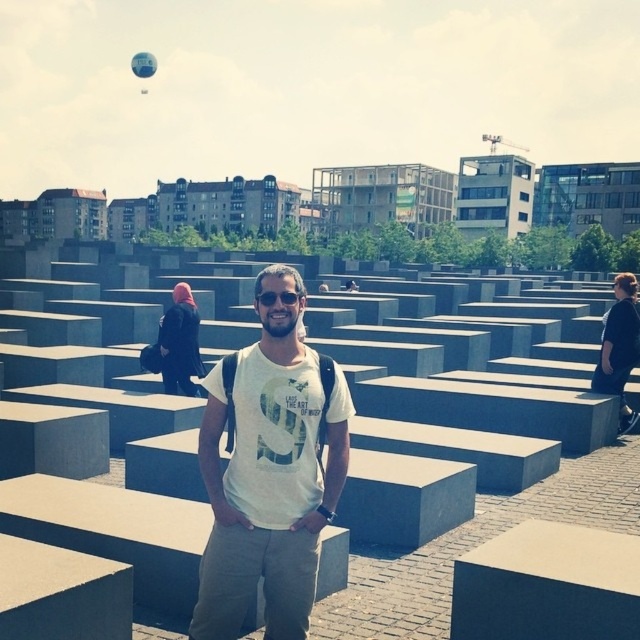
Is black matte shirt at center below translucent blue balloon at upper left?

Correct, black matte shirt at center is located below translucent blue balloon at upper left.

Based on the photo, measure the distance from black matte shirt at center to translucent blue balloon at upper left.

black matte shirt at center and translucent blue balloon at upper left are 192.68 meters apart.

Who is more forward, (620, 296) or (144, 58)?

Point (620, 296) is in front.

What are the coordinates of `black matte shirt at center` in the screenshot? It's located at (620, 348).

Who is higher up, white cotton t-shirt at center or black matte shirt at center?

black matte shirt at center is higher up.

Can you confirm if white cotton t-shirt at center is bigger than black matte shirt at center?

Actually, white cotton t-shirt at center might be smaller than black matte shirt at center.

Between point (264, 384) and point (634, 355), which one is positioned in front?

Point (264, 384) is in front.

Identify the location of white cotton t-shirt at center. This screenshot has width=640, height=640. (269, 472).

Which of these two, white cotton t-shirt at center or translucent blue balloon at upper left, stands shorter?

With less height is white cotton t-shirt at center.

Can you confirm if white cotton t-shirt at center is taller than translucent blue balloon at upper left?

In fact, white cotton t-shirt at center may be shorter than translucent blue balloon at upper left.

Which is behind, point (241, 532) or point (150, 65)?

Point (150, 65)

Find the location of a particular element. The image size is (640, 640). white cotton t-shirt at center is located at coordinates (269, 472).